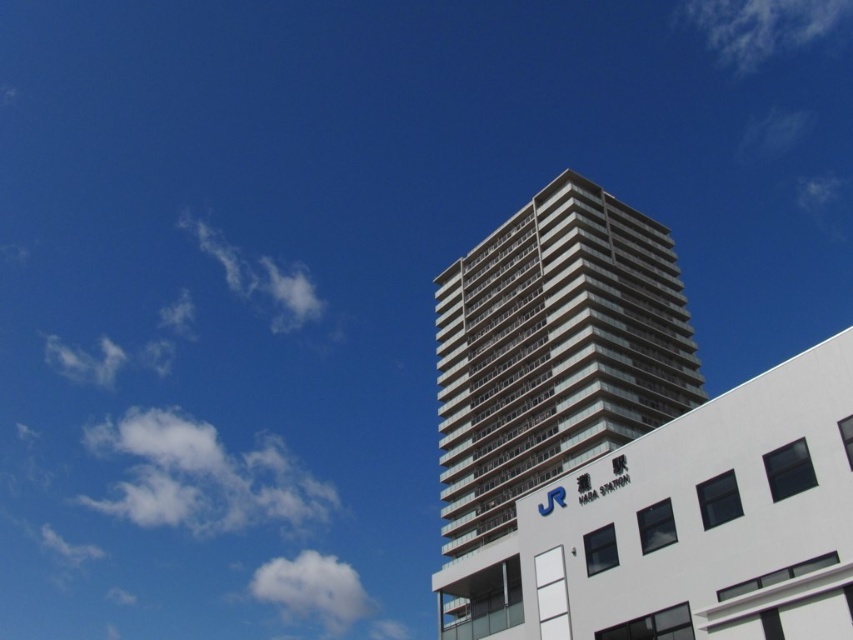
Who is positioned more to the left, white fluffy cloud at lower left or white fluffy cloud at upper left?

white fluffy cloud at upper left is more to the left.

Is point (257, 589) farther from viewer compared to point (270, 314)?

Yes, point (257, 589) is behind point (270, 314).

Locate an element on the screen. white fluffy cloud at lower left is located at coordinates (312, 589).

Does glassy concrete tower at center appear on the left side of white fluffy cloud at lower left?

Incorrect, glassy concrete tower at center is not on the left side of white fluffy cloud at lower left.

Which is above, glassy concrete tower at center or white fluffy cloud at lower left?

glassy concrete tower at center is higher up.

What do you see at coordinates (554, 349) in the screenshot? I see `glassy concrete tower at center` at bounding box center [554, 349].

The height and width of the screenshot is (640, 853). Find the location of `glassy concrete tower at center`. glassy concrete tower at center is located at coordinates (554, 349).

Looking at this image, measure the distance from white fluffy cloud at left to white fluffy cloud at lower left.

34.45 meters

Does white fluffy cloud at left appear on the left side of white fluffy cloud at lower left?

Yes, white fluffy cloud at left is to the left of white fluffy cloud at lower left.

Is point (137, 492) positioned before point (288, 593)?

That is False.

You are a GUI agent. You are given a task and a screenshot of the screen. Output one action in this format:
    pyautogui.click(x=<x>, y=<y>)
    Task: Click on the white fluffy cloud at left
    This screenshot has width=853, height=640.
    Given the screenshot: What is the action you would take?
    pyautogui.click(x=202, y=476)